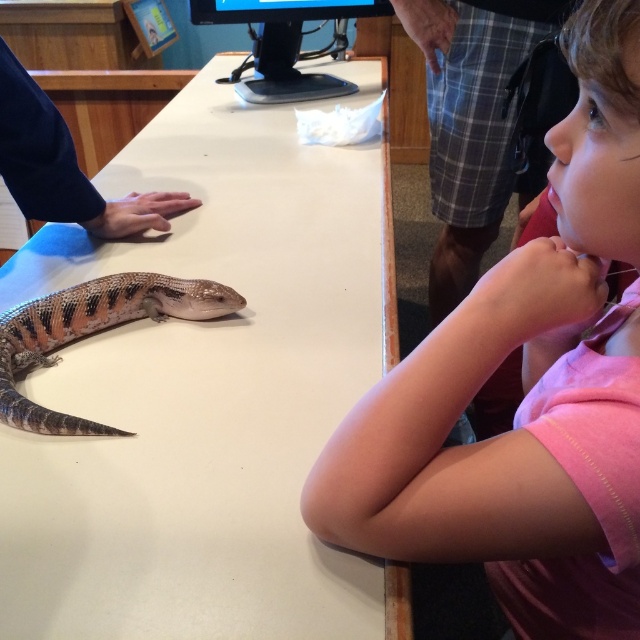
Looking at this image, you are a child trying to place your pink cotton shirt at upper right on the white smooth table at center. Can you fit your shirt on the table?

The white smooth table at center has a larger size compared to pink cotton shirt at upper right, so yes, the shirt can fit on the table.

You are a child trying to touch the lizard on the table. The adult has placed a sticker at point (202, 394) on the table to show where you can safely touch. Where is this sticker located on the table?

The sticker at point (202, 394) is located at the center of the white smooth table at center.

You are standing in the room and want to place a small toy on the white smooth table at center. Based on the coordinates provided, where exactly should you place it?

The white smooth table at center is located at coordinates point (202, 394), so you should place the small toy there.